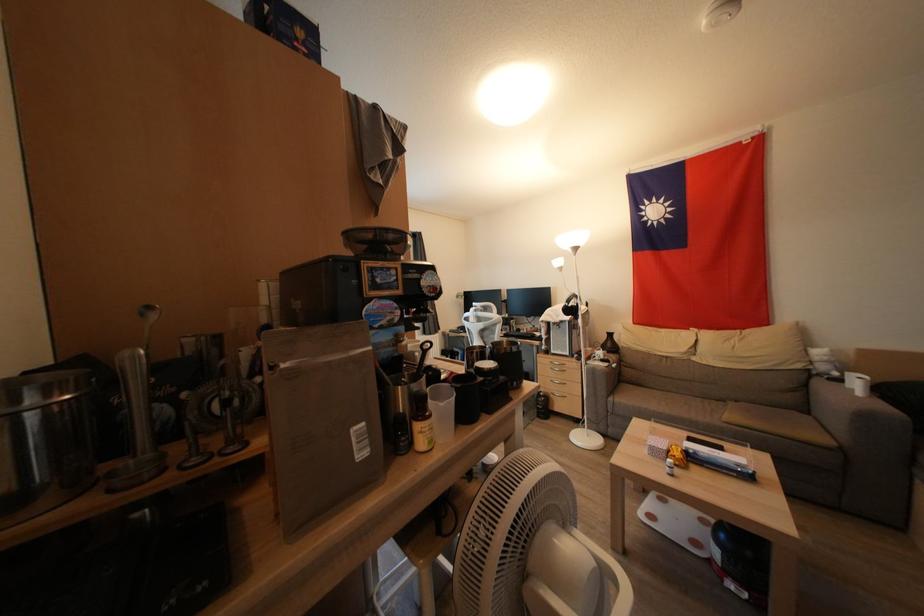
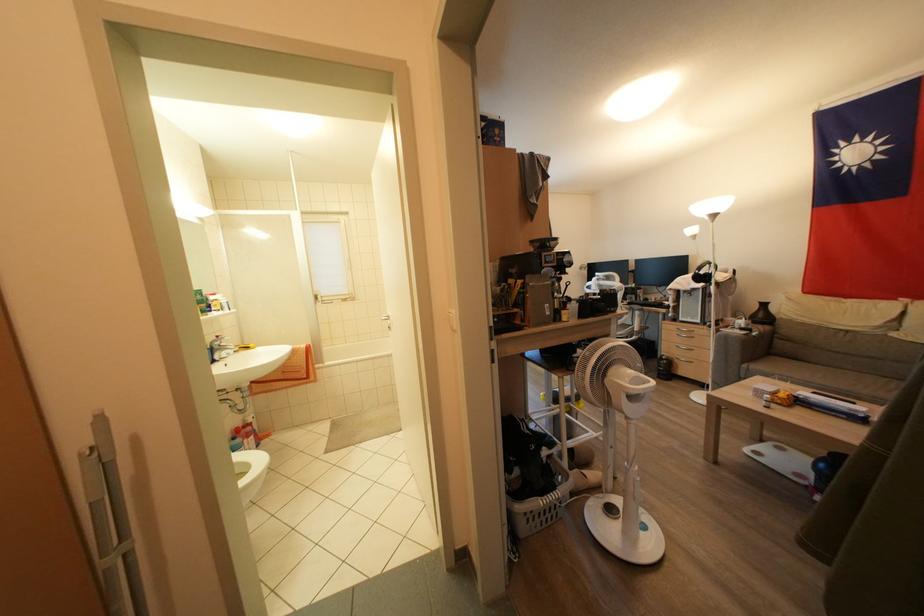
Where in the second image is the point corresponding to point (554, 310) from the first image?

(689, 278)